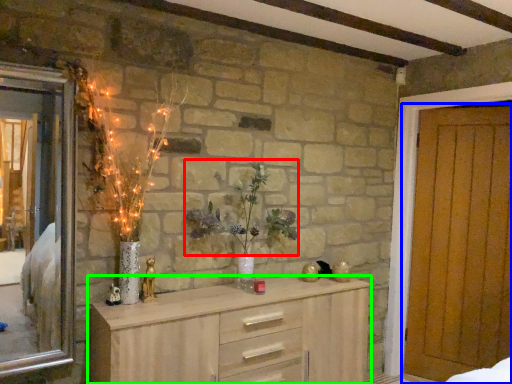
Question: Estimate the real-world distances between objects in this image. Which object is farther from floral arrangement (highlighted by a red box), door (highlighted by a blue box) or chest of drawers (highlighted by a green box)?

Choices:
 (A) door
 (B) chest of drawers

Answer: (A)